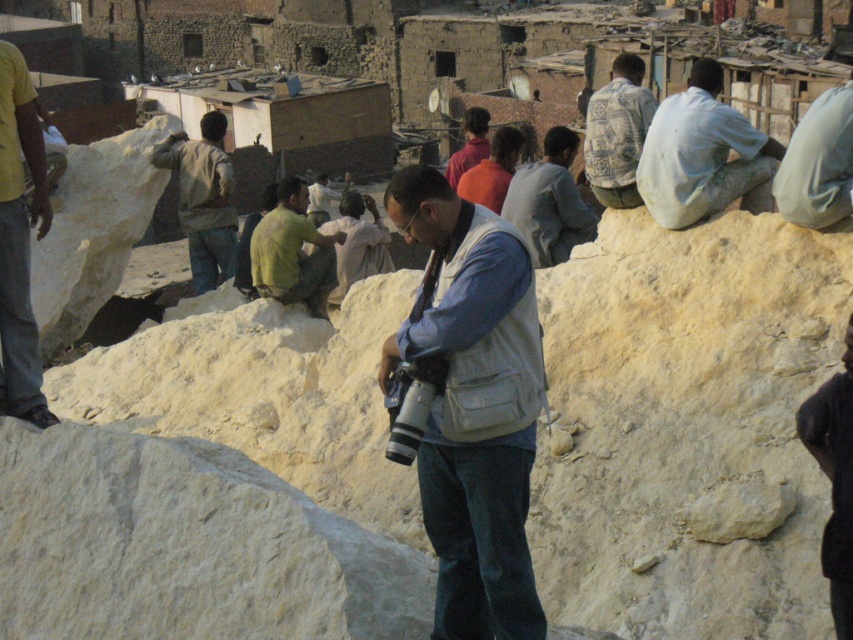
Question: Does white cotton shirt at upper right have a greater width compared to yellow-green fabric shirt at center?

Choices:
 (A) yes
 (B) no

Answer: (A)

Question: Is white cotton shirt at upper right positioned before light gray fabric pants at upper right?

Choices:
 (A) yes
 (B) no

Answer: (B)

Question: Which object is farther from the camera taking this photo?

Choices:
 (A) light brown fabric jacket at left
 (B) light gray fabric shirt at upper center

Answer: (A)

Question: In this image, where is white cotton shirt at upper right located relative to yellow cotton shirt at left?

Choices:
 (A) right
 (B) left

Answer: (A)

Question: Which object appears closest to the camera in this image?

Choices:
 (A) white cotton shirt at upper right
 (B) yellow-green fabric shirt at center

Answer: (A)

Question: Among these points, which one is farthest from the camera?

Choices:
 (A) (845, 138)
 (B) (479, 125)
 (C) (675, 225)

Answer: (B)